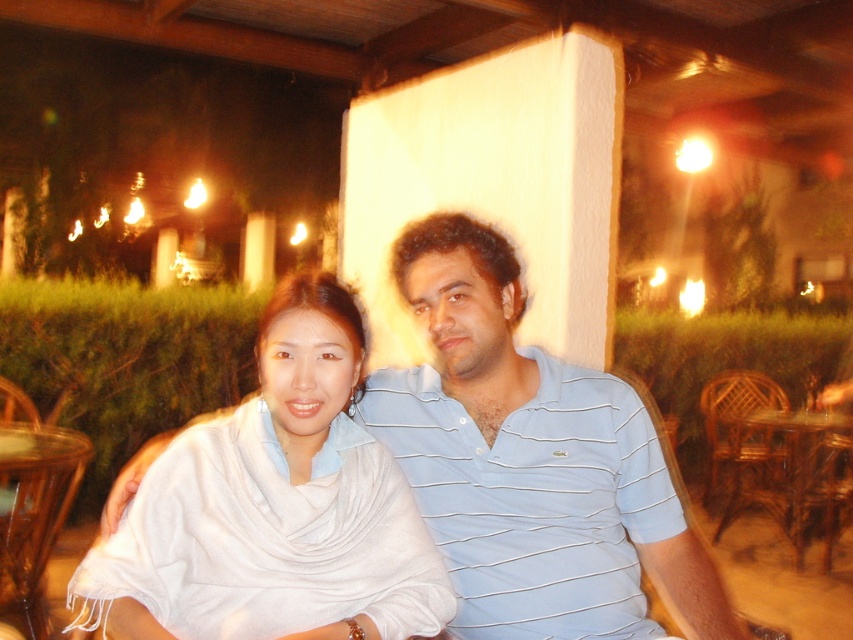
You are a photographer trying to capture a closeup of the white silk scarf at center without including the wooden at right in the background. Based on the scene description, is this possible?

Yes, because the white silk scarf at center is in front of the wooden at right, so if you focus on the scarf and ensure the wooden at right is out of frame or blurred, it can be excluded from the background.

You are a photographer setting up a shot of the two people in the scene. You want to ensure that the light blue striped polo shirt at center and the wooden table at lower left are both clearly visible in your composition. Based on their positions, which object is closer to the camera?

The light blue striped polo shirt at center is located above the wooden table at lower left, meaning it is closer to the camera than the wooden table at lower left.